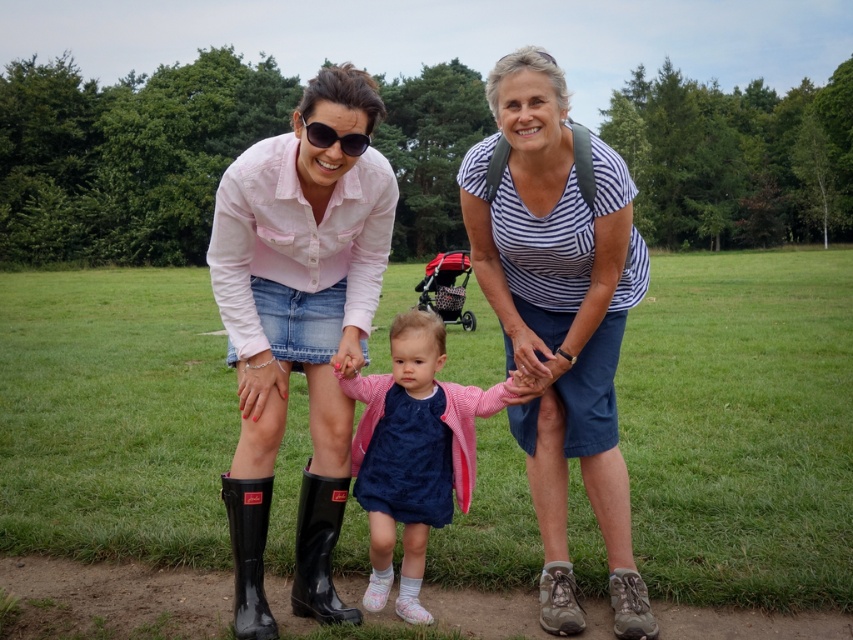
Can you confirm if striped cotton shirt at center is positioned to the right of matte black sunglasses at center?

Yes, striped cotton shirt at center is to the right of matte black sunglasses at center.

Is striped cotton shirt at center behind matte black sunglasses at center?

Yes, it is behind matte black sunglasses at center.

I want to click on striped cotton shirt at center, so click(560, 316).

From the picture: Who is lower down, matte black boots at lower left or black rubber boot at lower left?

black rubber boot at lower left

Does matte black boots at lower left have a lesser height compared to black rubber boot at lower left?

Yes, matte black boots at lower left is shorter than black rubber boot at lower left.

Is point (619, 490) positioned in front of point (235, 600)?

No, it is not.

Find the location of a particular element. This screenshot has width=853, height=640. matte black boots at lower left is located at coordinates (560, 312).

Does matte pink shirt at center have a smaller size compared to pink fabric dress at center?

No.

Is point (305, 92) more distant than point (389, 529)?

Yes.

The width and height of the screenshot is (853, 640). What do you see at coordinates (299, 324) in the screenshot?
I see `matte pink shirt at center` at bounding box center [299, 324].

Where is `matte pink shirt at center`? Image resolution: width=853 pixels, height=640 pixels. matte pink shirt at center is located at coordinates (299, 324).